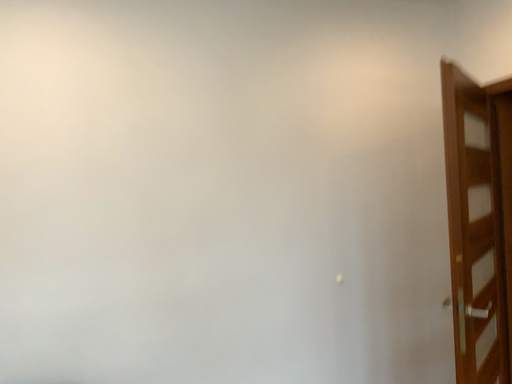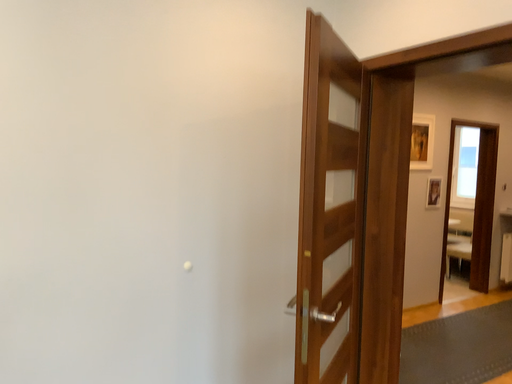
Question: How did the camera likely rotate when shooting the video?

Choices:
 (A) rotated left
 (B) rotated right

Answer: (B)